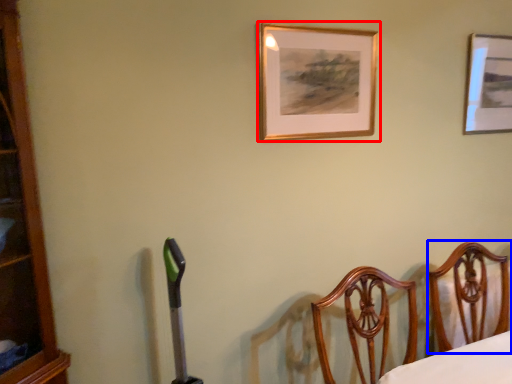
Question: Among these objects, which one is farthest to the camera, picture frame (highlighted by a red box) or furniture (highlighted by a blue box)?

Choices:
 (A) picture frame
 (B) furniture

Answer: (A)